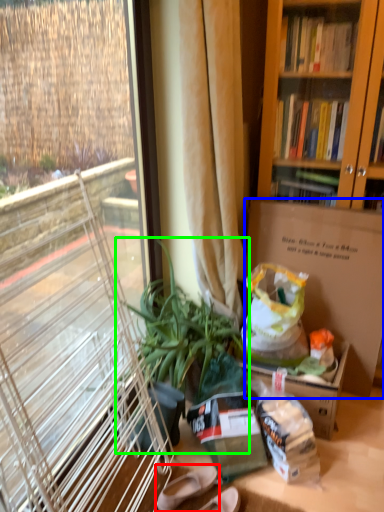
Question: Which is farther away from footwear (highlighted by a red box)? box (highlighted by a blue box) or houseplant (highlighted by a green box)?

Choices:
 (A) box
 (B) houseplant

Answer: (A)